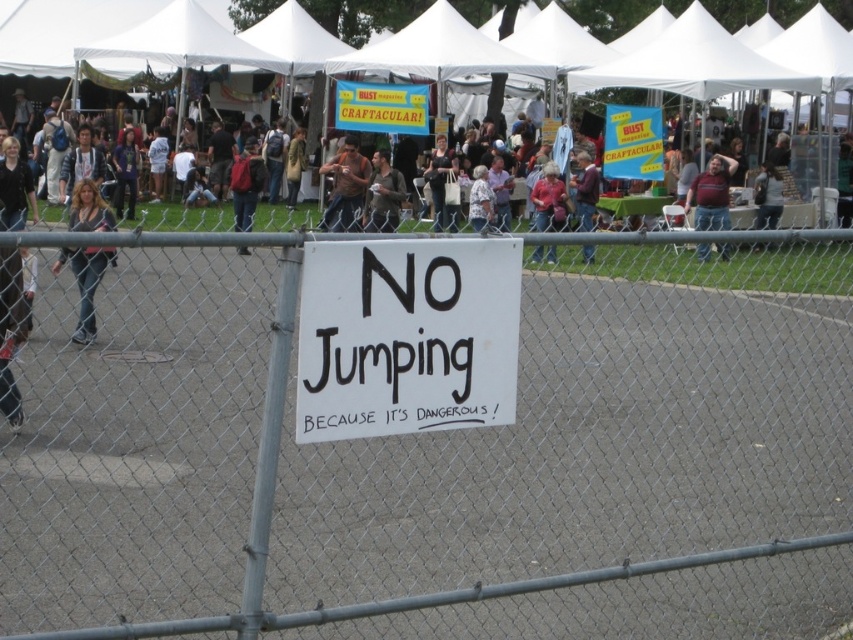
Does white chain-link fence at center have a smaller size compared to blonde hair at center?

No.

Can you confirm if white chain-link fence at center is positioned above blonde hair at center?

Actually, white chain-link fence at center is below blonde hair at center.

Locate an element on the screen. white chain-link fence at center is located at coordinates (432, 436).

Does yellow paper sign at upper center lie behind yellow paper sign at center?

Yes, it is behind yellow paper sign at center.

Between yellow paper sign at upper center and yellow paper sign at center, which one has less height?

With less height is yellow paper sign at upper center.

Is point (341, 100) farther from camera compared to point (659, 109)?

Yes, it is.

This screenshot has width=853, height=640. In order to click on yellow paper sign at upper center in this screenshot , I will do `click(381, 108)`.

Is brown leather jacket at center above maroon sweater at center?

Yes.

Locate an element on the screen. This screenshot has width=853, height=640. brown leather jacket at center is located at coordinates (345, 188).

Locate an element on the screen. brown leather jacket at center is located at coordinates (345, 188).